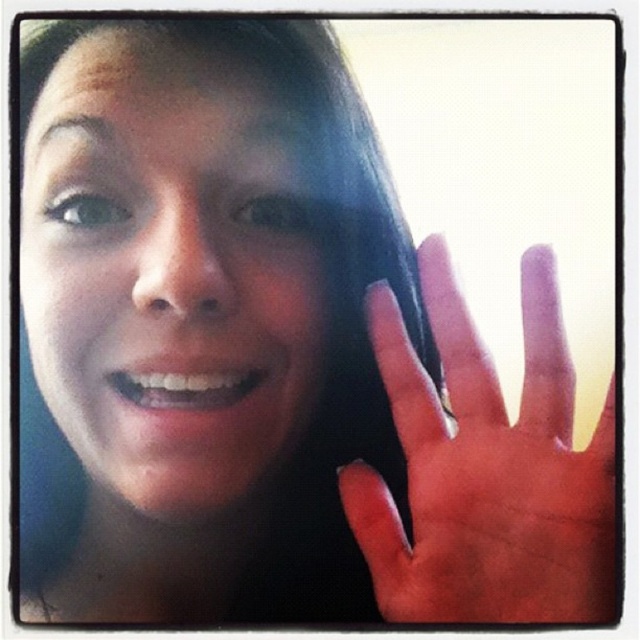
Based on the scene description, which object is taller between the smooth skin face at center and the dry skin hand at right?

The smooth skin face at center is much taller than the dry skin hand at right.

You are a photographer adjusting the lighting for a portrait. You want to ensure the dry skin hand at right is visible without overpowering the smooth skin face at center. Given their positions, what adjustment should you make?

Since the dry skin hand at right is behind the smooth skin face at center, you should adjust the lighting to focus more on the face while slightly dimming the hand to maintain the subject as the main focus without losing visibility of the hand.

You are a photographer adjusting the focus of your camera. The subject has a smooth skin face at center and a dry skin hand at right. To ensure both are in focus, what is the minimum distance the camera should be set to focus at?

The minimum focusing distance should be set to 4.98 inches to ensure both the smooth skin face at center and dry skin hand at right are in focus since they are 4.98 inches apart.